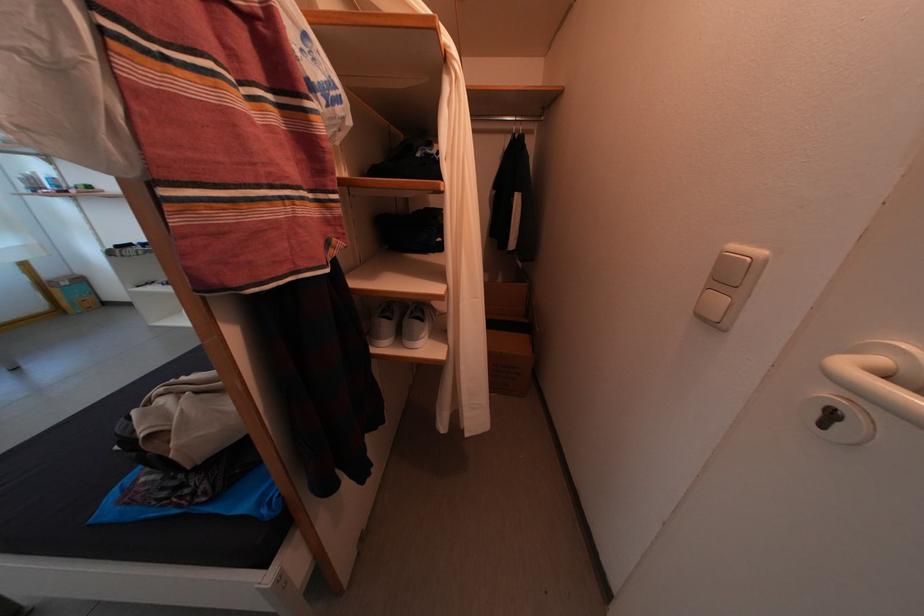
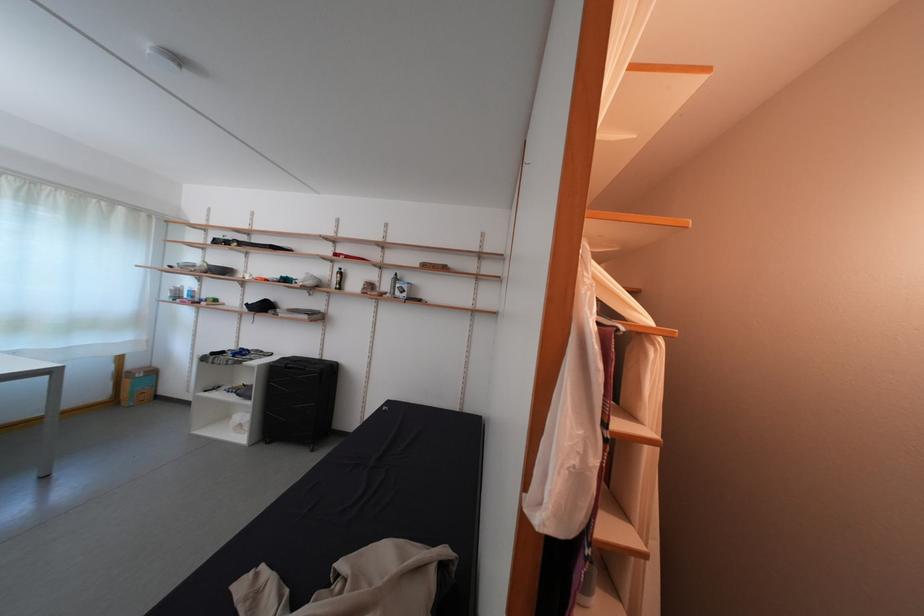
Where in the second image is the point corresponding to point 55,281 from the first image?

(140, 371)